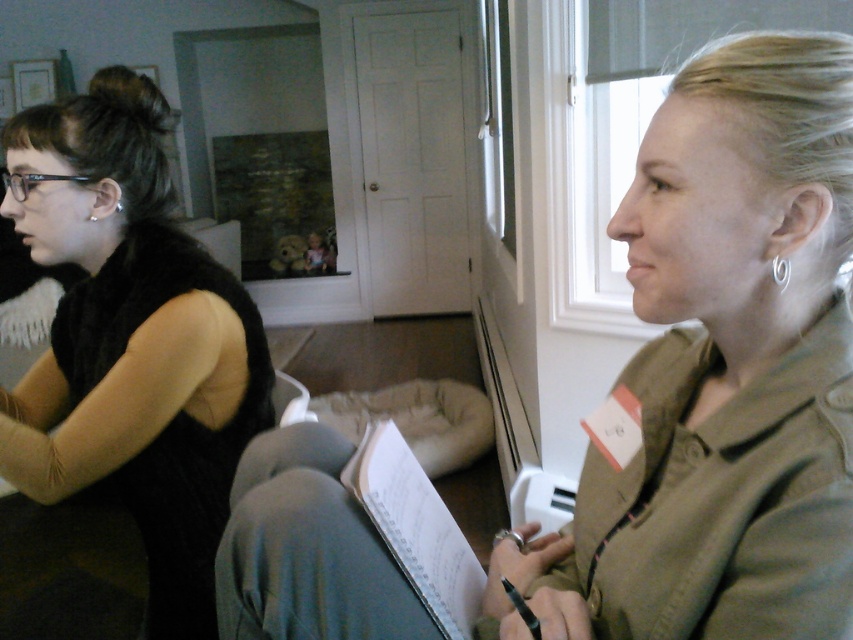
Question: Which point is closer to the camera taking this photo?

Choices:
 (A) (773, 268)
 (B) (402, 561)
 (C) (51, 262)

Answer: (A)

Question: Which point is farther to the camera?

Choices:
 (A) (456, 627)
 (B) (3, 467)

Answer: (B)

Question: Is matte olive green jacket at right bigger than silver metallic earring at right ear?

Choices:
 (A) yes
 (B) no

Answer: (A)

Question: Which point is farther to the camera?

Choices:
 (A) (376, 444)
 (B) (788, 278)
 (C) (227, 436)

Answer: (C)

Question: Can you confirm if black velvet top at left is positioned below white paper at center?

Choices:
 (A) yes
 (B) no

Answer: (B)

Question: Is black velvet top at left below white paper at center?

Choices:
 (A) no
 (B) yes

Answer: (A)